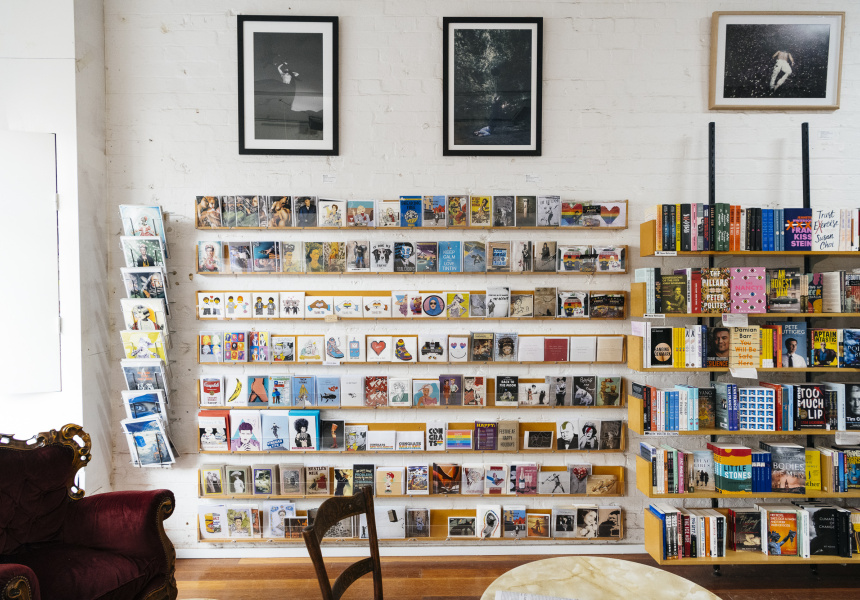
Where is `magazines`? The image size is (860, 600). magazines is located at coordinates (140, 210), (136, 243), (140, 279), (133, 307), (139, 337), (140, 375), (145, 403), (140, 432).